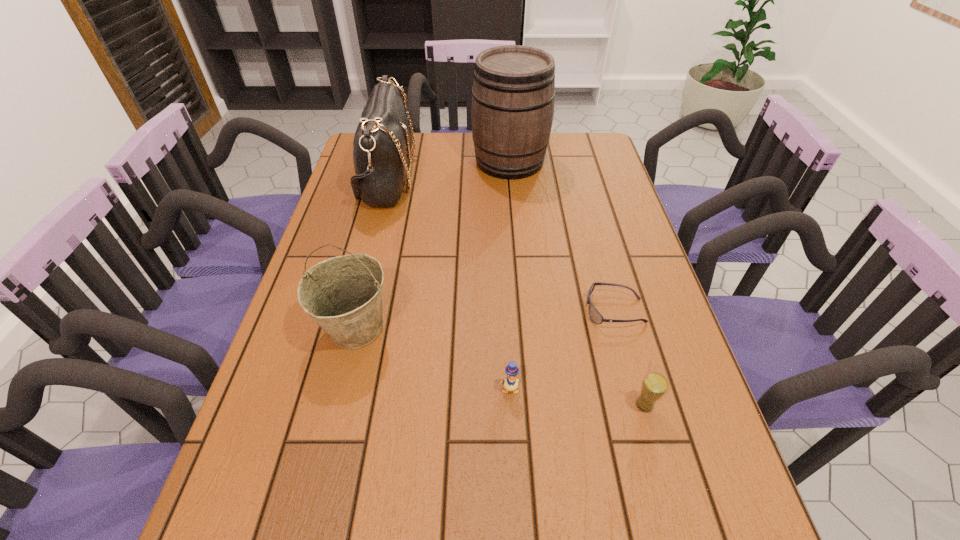
Where is `the farther wine bucket`? the farther wine bucket is located at coordinates (513, 93).

Identify the location of the taller wine bucket. (513, 93).

Identify the location of handbag. This screenshot has width=960, height=540. (382, 143).

Find the location of a particular element. The width and height of the screenshot is (960, 540). the shorter wine bucket is located at coordinates (343, 295).

Locate an element on the screen. The height and width of the screenshot is (540, 960). the left wine bucket is located at coordinates (343, 295).

Where is `the third shortest object`? the third shortest object is located at coordinates (654, 385).

Locate an element on the screen. duckling is located at coordinates (510, 384).

I want to click on the shortest object, so pos(595,316).

In order to click on vacant area situated 0.220m on the right of the farther wine bucket in this screenshot , I will do `click(610, 161)`.

Find the location of a particular element. The width and height of the screenshot is (960, 540). vacant area situated at the front of the handbag with chain and zipper is located at coordinates (431, 178).